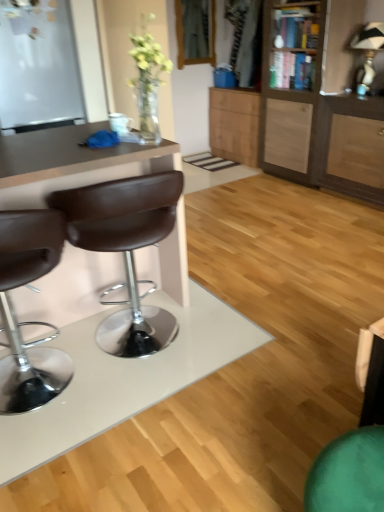
This screenshot has height=512, width=384. I want to click on free space to the left of wooden cabinet at right, placed as the first cabinetry when sorted from front to back, so click(234, 174).